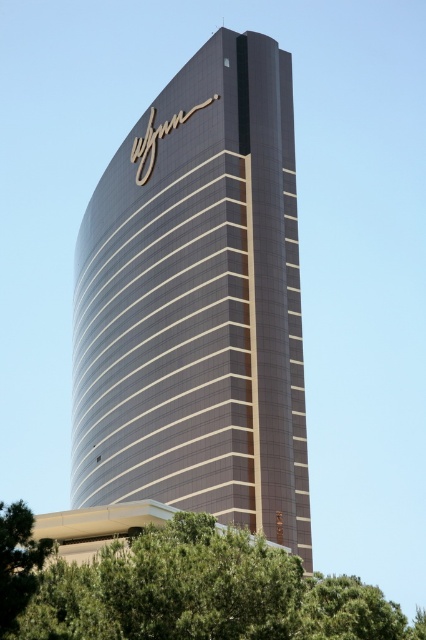
You are a photographer planning to capture the glossy glass tower at center and the green leafy tree at lower center in a single frame. Based on their sizes, which object would appear larger in the photo?

The glossy glass tower at center would appear larger in the photo because its width surpasses that of the green leafy tree at lower center, as stated in the description.

You are standing at point (219, 250) and want to walk to the entrance of the Wynn building. The entrance is located at the base of the structure. Given that the distance between your current position and the entrance is 245.19 feet, can you estimate how long it would take to walk there at a normal pace of 3 feet per second?

The distance between point (219, 250) and the entrance is 245.19 feet. At a normal walking pace of 3 feet per second, it would take approximately 81.7 seconds, which is roughly 1 minute and 22 seconds.

You are standing in front of the Wynn building and want to take a photo that includes both the glossy glass tower at center and the green leafy tree at lower center. Which object should you focus on first to ensure both are in frame?

The glossy glass tower at center is positioned over green leafy tree at lower center, so you should focus on the green leafy tree at lower center first to ensure both are in frame.